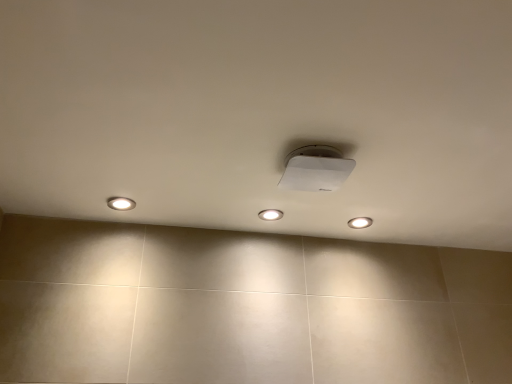
Question: Considering the relative sizes of white plastic lamp at center and white glossy light fixture at upper center, which appears as the third dot when viewed from the left, in the image provided, is white plastic lamp at center wider than white glossy light fixture at upper center, which appears as the third dot when viewed from the left,?

Choices:
 (A) yes
 (B) no

Answer: (A)

Question: Does white plastic lamp at center have a lesser height compared to white glossy light fixture at upper center, which appears as the third dot when viewed from the left?

Choices:
 (A) no
 (B) yes

Answer: (A)

Question: Is white plastic lamp at center facing away from white glossy light fixture at upper center, the 1th dot viewed from the back?

Choices:
 (A) no
 (B) yes

Answer: (A)

Question: Is white plastic lamp at center to the right of white glossy light fixture at upper center, which appears as the third dot when viewed from the left, from the viewer's perspective?

Choices:
 (A) no
 (B) yes

Answer: (A)

Question: Does white plastic lamp at center lie in front of white glossy light fixture at upper center, which is the first dot in right-to-left order?

Choices:
 (A) yes
 (B) no

Answer: (A)

Question: Is white plastic lamp at center taller than white glossy light fixture at upper center, acting as the 3th dot starting from the front?

Choices:
 (A) no
 (B) yes

Answer: (B)

Question: From the image's perspective, is white glossy light fixture at upper center, acting as the 3th dot starting from the front, on white plastic lamp at center?

Choices:
 (A) no
 (B) yes

Answer: (A)

Question: Is the position of white glossy light fixture at upper center, which appears as the third dot when viewed from the left, more distant than that of white plastic lamp at center?

Choices:
 (A) yes
 (B) no

Answer: (A)

Question: Does white glossy light fixture at upper center, which is the first dot in right-to-left order, appear on the right side of white plastic lamp at center?

Choices:
 (A) yes
 (B) no

Answer: (A)

Question: Could white plastic lamp at center be considered to be inside white glossy light fixture at upper center, acting as the 3th dot starting from the front?

Choices:
 (A) no
 (B) yes

Answer: (A)

Question: Can you confirm if white glossy light fixture at upper center, the 1th dot viewed from the back, is bigger than white plastic lamp at center?

Choices:
 (A) yes
 (B) no

Answer: (B)

Question: Is white glossy light fixture at upper center, which is the first dot in right-to-left order, positioned in front of white plastic lamp at center?

Choices:
 (A) no
 (B) yes

Answer: (A)

Question: Can you confirm if white glossy light fixture at center, which appears as the 2th dot when viewed from the back, is smaller than matte white light at left, acting as the first dot starting from the left?

Choices:
 (A) no
 (B) yes

Answer: (B)